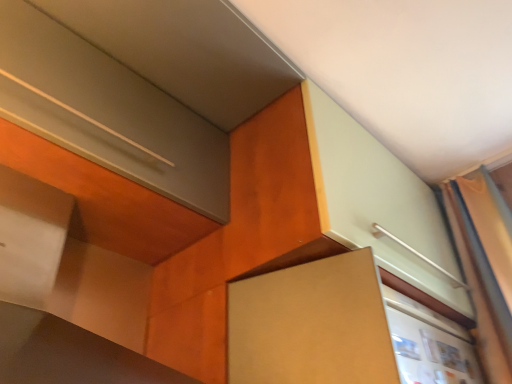
Question: From the image's perspective, relative to silky orange curtain at right, is brown matte cabinet at center above or below?

Choices:
 (A) below
 (B) above

Answer: (A)

Question: Looking at their shapes, would you say brown matte cabinet at center is wider or thinner than silky orange curtain at right?

Choices:
 (A) thin
 (B) wide

Answer: (B)

Question: From a real-world perspective, is brown matte cabinet at center physically located above or below silky orange curtain at right?

Choices:
 (A) below
 (B) above

Answer: (A)

Question: Considering the positions of silky orange curtain at right and brown matte cabinet at center in the image, is silky orange curtain at right wider or thinner than brown matte cabinet at center?

Choices:
 (A) thin
 (B) wide

Answer: (A)

Question: Considering the positions of silky orange curtain at right and brown matte cabinet at center in the image, is silky orange curtain at right bigger or smaller than brown matte cabinet at center?

Choices:
 (A) big
 (B) small

Answer: (A)

Question: Does point (468, 198) appear closer or farther from the camera than point (297, 382)?

Choices:
 (A) closer
 (B) farther

Answer: (B)

Question: Considering the relative positions of silky orange curtain at right and brown matte cabinet at center in the image provided, is silky orange curtain at right to the left or to the right of brown matte cabinet at center?

Choices:
 (A) left
 (B) right

Answer: (B)